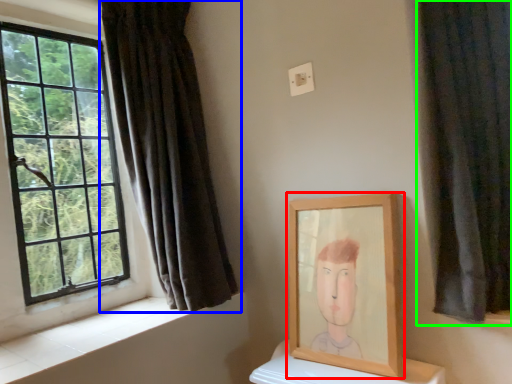
Question: Which is nearer to the picture frame (highlighted by a red box)? curtain (highlighted by a blue box) or curtain (highlighted by a green box).

Choices:
 (A) curtain
 (B) curtain

Answer: (B)